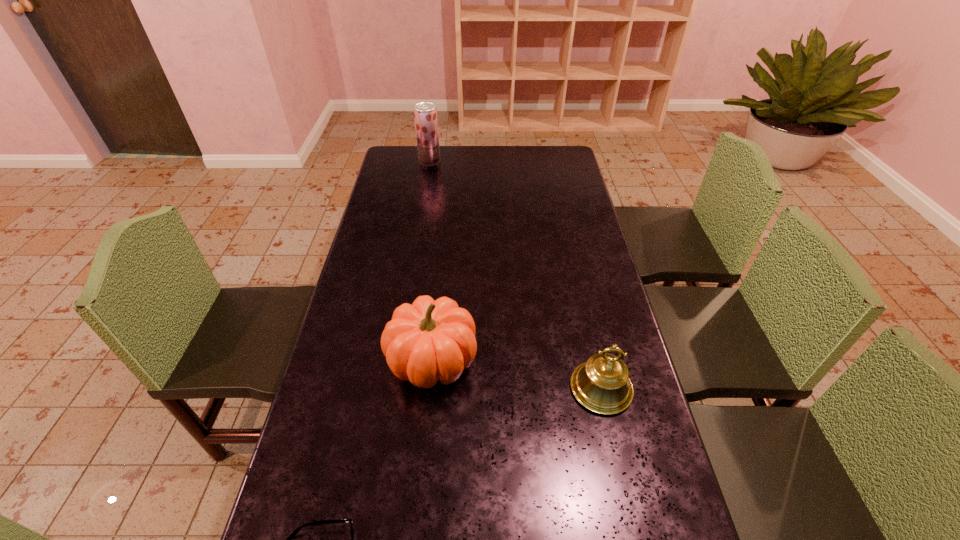
I want to click on the farthest object, so pos(425,113).

Where is `pumpkin`? The height and width of the screenshot is (540, 960). pumpkin is located at coordinates (427, 341).

Locate an element on the screen. This screenshot has width=960, height=540. bell is located at coordinates (601, 384).

Where is `the rightmost object`? the rightmost object is located at coordinates (601, 384).

What are the coordinates of `free space located on the back of the farthest object` in the screenshot? It's located at (432, 145).

This screenshot has width=960, height=540. What are the coordinates of `vacant space situated on the back of the pumpkin` in the screenshot? It's located at (441, 263).

This screenshot has height=540, width=960. I want to click on vacant point located 0.090m on the front of the bell, so coord(615,453).

Locate an element on the screen. object located at the far edge is located at coordinates (425, 113).

Identify the location of fruit juice that is at the left edge. (425, 113).

Where is `pumpkin positioned at the left edge`? pumpkin positioned at the left edge is located at coordinates (427, 341).